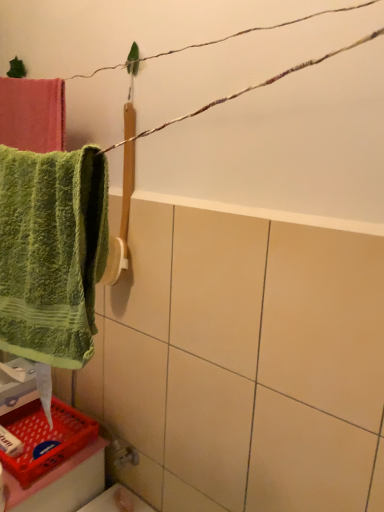
Consider the image. In order to face white matte soap at lower left, should I rotate leftwards or rightwards?

Turn left by 23.746 degrees to look at white matte soap at lower left.

What is the approximate height of red plastic basket at lower left?

The height of red plastic basket at lower left is 4.09 centimeters.

What do you see at coordinates (51, 252) in the screenshot?
I see `green textured towel at left` at bounding box center [51, 252].

I want to click on white matte soap at lower left, so pos(10,443).

Would you say white matte soap at lower left is a long distance from red plastic basket at lower left?

No, there isn't a large distance between white matte soap at lower left and red plastic basket at lower left.

Based on their sizes in the image, would you say white matte soap at lower left is bigger or smaller than red plastic basket at lower left?

Clearly, white matte soap at lower left is smaller in size than red plastic basket at lower left.

From a real-world perspective, which is physically above, white matte soap at lower left or red plastic basket at lower left?

white matte soap at lower left, from a real-world perspective.

Which object is thinner, green textured towel at left or white matte soap at lower left?

With smaller width is white matte soap at lower left.

From the image's perspective, does green textured towel at left appear lower than white matte soap at lower left?

No, from the image's perspective, green textured towel at left is not below white matte soap at lower left.

From a real-world perspective, is green textured towel at left physically located above or below white matte soap at lower left?

In terms of real-world spatial position, green textured towel at left is above white matte soap at lower left.

Is point (20, 186) positioned before point (8, 436)?

Yes, point (20, 186) is closer to viewer.

Locate an element on the screen. The height and width of the screenshot is (512, 384). basket in front of the white matte soap at lower left is located at coordinates (45, 438).

Considering the sizes of red plastic basket at lower left and white matte soap at lower left in the image, is red plastic basket at lower left taller or shorter than white matte soap at lower left?

Considering their sizes, red plastic basket at lower left has less height than white matte soap at lower left.

From the image's perspective, between red plastic basket at lower left and white matte soap at lower left, who is located below?

red plastic basket at lower left.

Which of these two, red plastic basket at lower left or white matte soap at lower left, is bigger?

red plastic basket at lower left.

Where is `towel located on the right of red plastic basket at lower left`? The image size is (384, 512). towel located on the right of red plastic basket at lower left is located at coordinates (51, 252).

From a real-world perspective, is red plastic basket at lower left above or below green textured towel at left?

red plastic basket at lower left is situated lower than green textured towel at left in the real world.

Is red plastic basket at lower left bigger or smaller than green textured towel at left?

Considering their sizes, red plastic basket at lower left takes up less space than green textured towel at left.

Does green textured towel at left turn towards red plastic basket at lower left?

No, green textured towel at left is not oriented towards red plastic basket at lower left.

Is green textured towel at left located outside red plastic basket at lower left?

That's correct, green textured towel at left is outside of red plastic basket at lower left.

From a real-world perspective, between green textured towel at left and red plastic basket at lower left, who is vertically lower?

red plastic basket at lower left, from a real-world perspective.

Is green textured towel at left at the back of white matte soap at lower left?

No.

Is white matte soap at lower left at the left side of green textured towel at left?

Correct, you'll find white matte soap at lower left to the left of green textured towel at left.

From the image's perspective, between white matte soap at lower left and green textured towel at left, who is located below?

white matte soap at lower left, from the image's perspective.

Image resolution: width=384 pixels, height=512 pixels. Identify the location of basket to the right of white matte soap at lower left. (45, 438).

Where is `towel lying in front of the white matte soap at lower left`? towel lying in front of the white matte soap at lower left is located at coordinates (51, 252).

Which object lies nearer to the anchor point white matte soap at lower left, red plastic basket at lower left or green textured towel at left?

red plastic basket at lower left.

When comparing their distances from green textured towel at left, does white matte soap at lower left or red plastic basket at lower left seem further?

Among the two, white matte soap at lower left is located further to green textured towel at left.

Which object lies nearer to the anchor point red plastic basket at lower left, white matte soap at lower left or green textured towel at left?

white matte soap at lower left lies closer to red plastic basket at lower left than the other object.

Based on their spatial positions, is green textured towel at left or red plastic basket at lower left closer to white matte soap at lower left?

red plastic basket at lower left is closer to white matte soap at lower left.

Based on the photo, looking at the image, which one is located further to green textured towel at left, red plastic basket at lower left or white matte soap at lower left?

white matte soap at lower left is positioned further to the anchor green textured towel at left.

Looking at this image, looking at the image, which one is located further to red plastic basket at lower left, green textured towel at left or white matte soap at lower left?

The object further to red plastic basket at lower left is green textured towel at left.

Find the location of a particular element. The height and width of the screenshot is (512, 384). basket between green textured towel at left and white matte soap at lower left in the front-back direction is located at coordinates (45, 438).